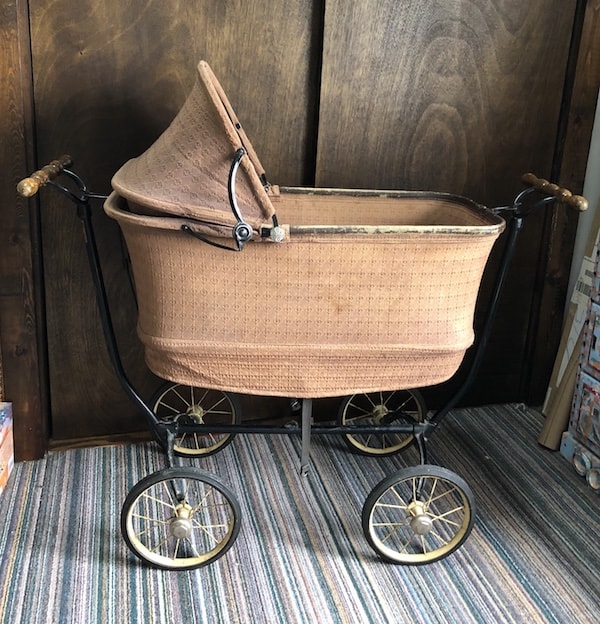
Image resolution: width=600 pixels, height=624 pixels. Find the location of `cover`. cover is located at coordinates (186, 150), (306, 452).